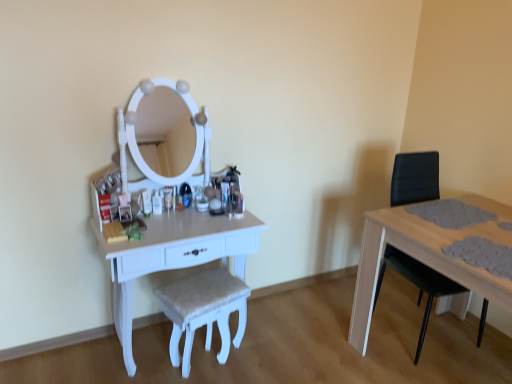
Where is `vacant area that is situated to the right of white textured stool at center`? vacant area that is situated to the right of white textured stool at center is located at coordinates (263, 359).